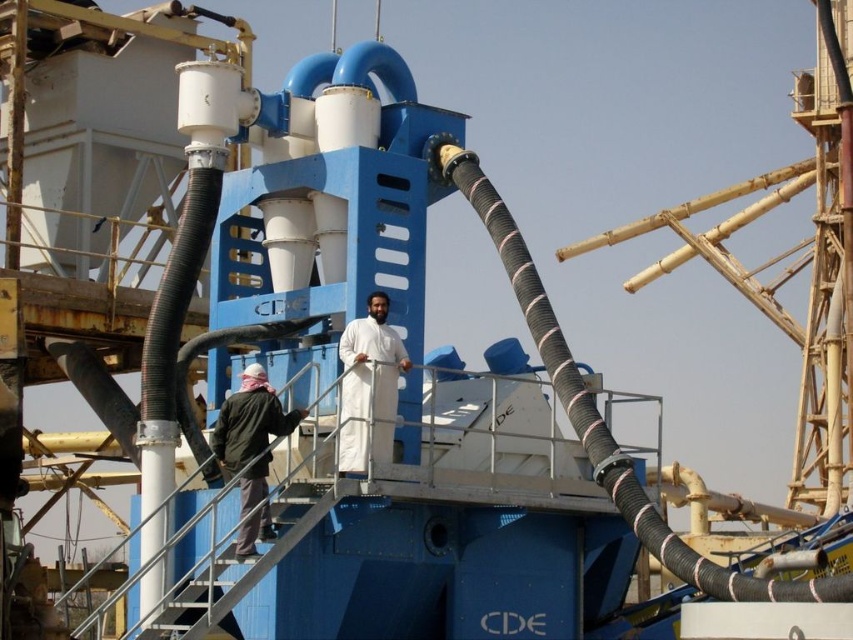
Is white matte clothing at center positioned in front of dark green jacket at lower left?

No, it is behind dark green jacket at lower left.

How much distance is there between white matte clothing at center and dark green jacket at lower left?

The distance of white matte clothing at center from dark green jacket at lower left is 9.82 feet.

Is point (349, 460) more distant than point (231, 449)?

Yes, it is behind point (231, 449).

Locate an element on the screen. white matte clothing at center is located at coordinates (369, 385).